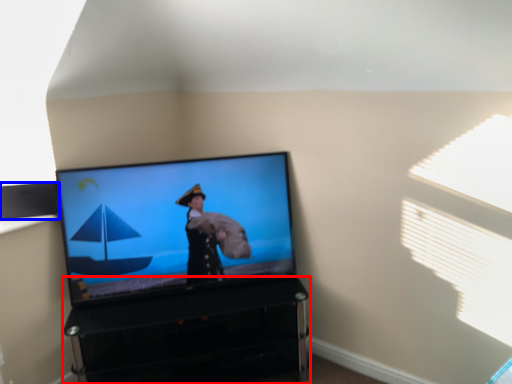
Question: Which object appears farthest to the camera in this image, furniture (highlighted by a red box) or speaker (highlighted by a blue box)?

Choices:
 (A) furniture
 (B) speaker

Answer: (B)